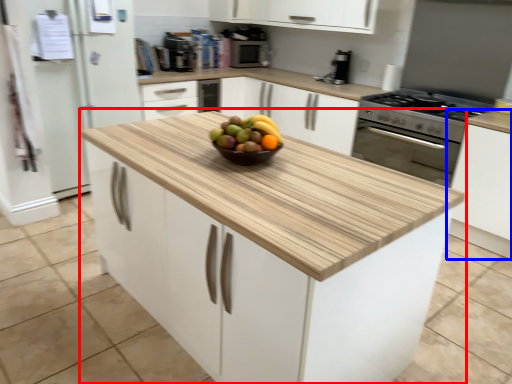
Question: Which point is further to the camera, cabinetry (highlighted by a red box) or cabinetry (highlighted by a blue box)?

Choices:
 (A) cabinetry
 (B) cabinetry

Answer: (B)